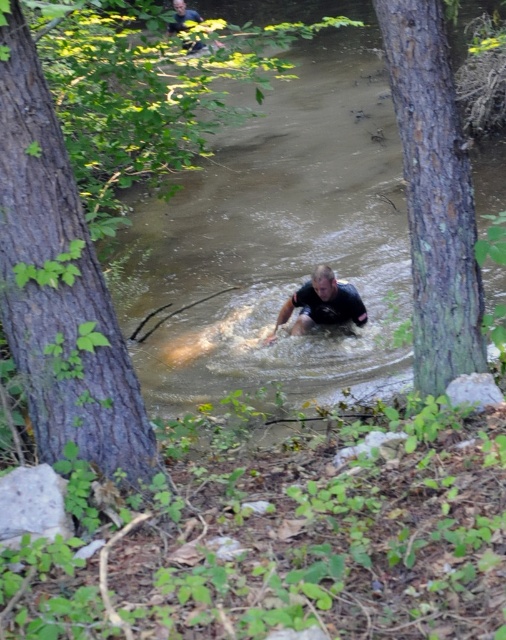
You are a hiker trying to cross the river. You notice the green rough bark tree at center and the black matte shirt at center. Which object is wider from your perspective?

The black matte shirt at center is wider than the green rough bark tree at center because the green rough bark tree at center has a smaller width according to the description.

You are a hiker trying to cross the river. You see two points in the river marked as point 1 at coordinates point (75, 328) and point 2 at coordinates point (454, 161). Which point is closer to you and safer to step on?

Point (75, 328) is closer to the viewer than point (454, 161), so it is safer to step on point (75, 328) since it is closer.